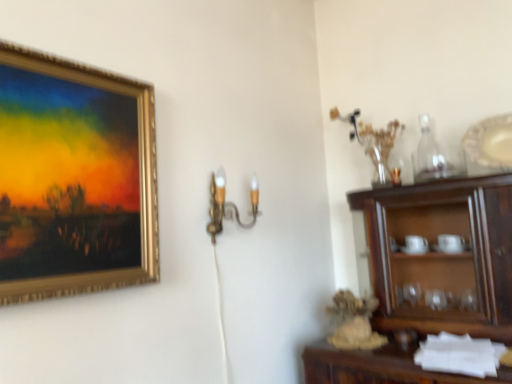
What are the coordinates of `empty space that is ontop of white wood cabinet at lower right (from a real-world perspective)` in the screenshot? It's located at (456, 338).